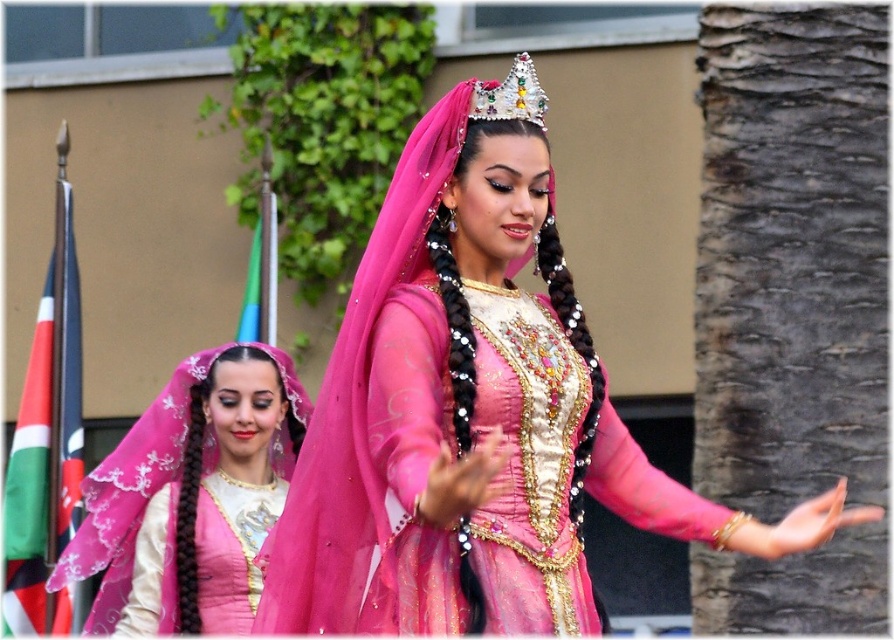
You are an event planner setting up a photo shoot for the cultural event. You need to position a camera at a specific height to capture both the matte pink dress at center and the matte pink fabric at center in the best possible way. Based on their heights, which object should the camera be adjusted to focus on first?

The camera should focus on the matte pink dress at center first since it has a greater height compared to the matte pink fabric at center, ensuring it is properly framed before adjusting for the shorter fabric.